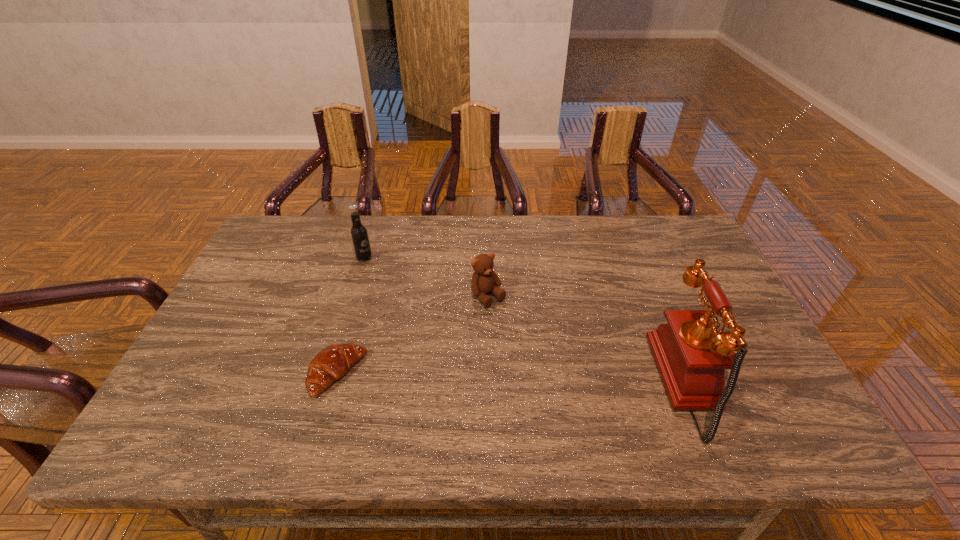
I want to click on the shortest object, so click(x=330, y=364).

What are the coordinates of `the rightmost object` in the screenshot? It's located at (691, 355).

The image size is (960, 540). Find the location of `telephone`. telephone is located at coordinates (691, 355).

Where is `the third tallest object`? The width and height of the screenshot is (960, 540). the third tallest object is located at coordinates (484, 280).

Identify the location of the second object from right to left. (484, 280).

The image size is (960, 540). Identify the location of root beer. (359, 235).

The width and height of the screenshot is (960, 540). Find the location of `the farthest object`. the farthest object is located at coordinates (359, 235).

At what (x,y) coordinates should I click in order to perform the action: click on blank area located 0.250m on the left of the crescent roll. Please return your answer as a coordinate pair (x, y). The width and height of the screenshot is (960, 540). Looking at the image, I should click on (206, 375).

Where is `vacant space located on the dial of the rightmost object`? vacant space located on the dial of the rightmost object is located at coordinates (750, 384).

Identify the location of blank space located 0.310m on the face of the third nearest object. [571, 388].